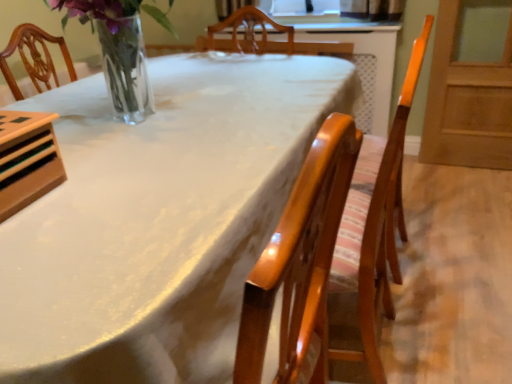
Measure the distance between point (254, 379) and camera.

18.19 inches.

Locate an element on the screen. This screenshot has height=384, width=512. glossy wood chair at center is located at coordinates (321, 249).

Describe the element at coordinates (321, 249) in the screenshot. I see `glossy wood chair at center` at that location.

The image size is (512, 384). What do you see at coordinates (158, 218) in the screenshot?
I see `white glossy table at center` at bounding box center [158, 218].

This screenshot has height=384, width=512. Identify the location of white glossy table at center. (158, 218).

What is the approximate height of white glossy table at center?

white glossy table at center is 79.11 centimeters in height.

At what (x,y) coordinates should I click in order to perform the action: click on glossy wood chair at center. Please return your answer as a coordinate pair (x, y). The image size is (512, 384). Looking at the image, I should click on (321, 249).

Is glossy wood chair at center at the left side of white glossy table at center?

In fact, glossy wood chair at center is to the right of white glossy table at center.

Is glossy wood chair at center further to camera compared to white glossy table at center?

Yes, it is behind white glossy table at center.

Considering the points (284, 328) and (214, 68), which point is behind, point (284, 328) or point (214, 68)?

Point (214, 68)

From the image's perspective, does glossy wood chair at center appear lower than white glossy table at center?

Actually, glossy wood chair at center appears above white glossy table at center in the image.

From a real-world perspective, relative to white glossy table at center, is glossy wood chair at center vertically above or below?

From a real-world perspective, glossy wood chair at center is physically above white glossy table at center.

Between glossy wood chair at center and white glossy table at center, which one has smaller width?

Result: With smaller width is glossy wood chair at center.

Considering the relative sizes of glossy wood chair at center and white glossy table at center in the image provided, is glossy wood chair at center taller than white glossy table at center?

Yes, glossy wood chair at center is taller than white glossy table at center.

Which of these two, glossy wood chair at center or white glossy table at center, is smaller?

Smaller between the two is glossy wood chair at center.

Is glossy wood chair at center situated inside white glossy table at center or outside?

glossy wood chair at center is located inside white glossy table at center.

Is glossy wood chair at center next to white glossy table at center?

No, glossy wood chair at center is not with white glossy table at center.

Is glossy wood chair at center oriented away from white glossy table at center?

Yes, glossy wood chair at center's orientation is away from white glossy table at center.

Find the location of a particular element. table on the left of glossy wood chair at center is located at coordinates (158, 218).

Which is more to the left, white glossy table at center or glossy wood chair at center?

white glossy table at center is more to the left.

Which is in front, white glossy table at center or glossy wood chair at center?

white glossy table at center is in front.

Which is more distant, (270,163) or (317,341)?

The point (270,163) is behind.

From the image's perspective, is white glossy table at center under glossy wood chair at center?

Yes, from the image's perspective, white glossy table at center is below glossy wood chair at center.

From a real-world perspective, is white glossy table at center physically located above or below glossy wood chair at center?

From a real-world perspective, white glossy table at center is physically below glossy wood chair at center.

Which of these two, white glossy table at center or glossy wood chair at center, is thinner?

glossy wood chair at center is thinner.

Considering the relative sizes of white glossy table at center and glossy wood chair at center in the image provided, is white glossy table at center shorter than glossy wood chair at center?

Yes.

In the scene shown: Can you confirm if white glossy table at center is smaller than glossy wood chair at center?

No.

Is glossy wood chair at center inside white glossy table at center?

Yes, glossy wood chair at center is inside white glossy table at center.

Are white glossy table at center and glossy wood chair at center far apart?

white glossy table at center is near glossy wood chair at center, not far away.

Is white glossy table at center facing away from glossy wood chair at center?

That's not correct — white glossy table at center is not looking away from glossy wood chair at center.

Consider the image. What's the angular difference between white glossy table at center and glossy wood chair at center's facing directions?

The facing directions of white glossy table at center and glossy wood chair at center are 92.8 degrees apart.

You are a GUI agent. You are given a task and a screenshot of the screen. Output one action in this format:
    pyautogui.click(x=<x>, y=<y>)
    Task: Click on the chair located above the white glossy table at center (from the image's perspective)
    Image resolution: width=512 pixels, height=384 pixels.
    Given the screenshot: What is the action you would take?
    pyautogui.click(x=321, y=249)

In the image, there is a glossy wood chair at center. Identify the location of table below it (from the image's perspective). The image size is (512, 384). (158, 218).

You are a GUI agent. You are given a task and a screenshot of the screen. Output one action in this format:
    pyautogui.click(x=<x>, y=<y>)
    Task: Click on the chair on the right of the white glossy table at center
    This screenshot has height=384, width=512.
    Given the screenshot: What is the action you would take?
    click(321, 249)